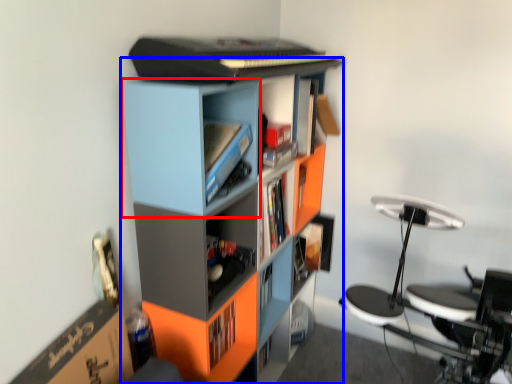
Question: Which object appears farthest to the camera in this image, cabinet (highlighted by a red box) or bookcase (highlighted by a blue box)?

Choices:
 (A) cabinet
 (B) bookcase

Answer: (A)